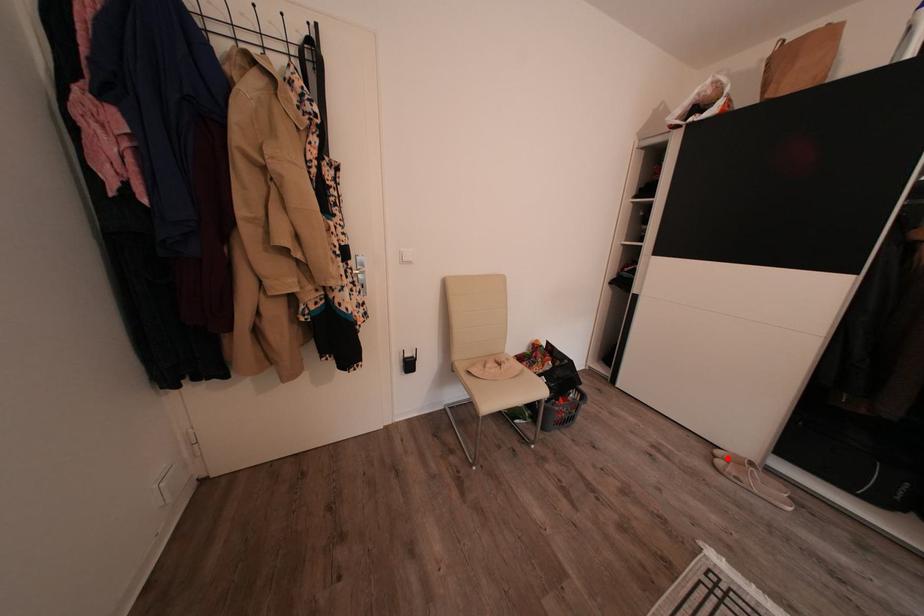
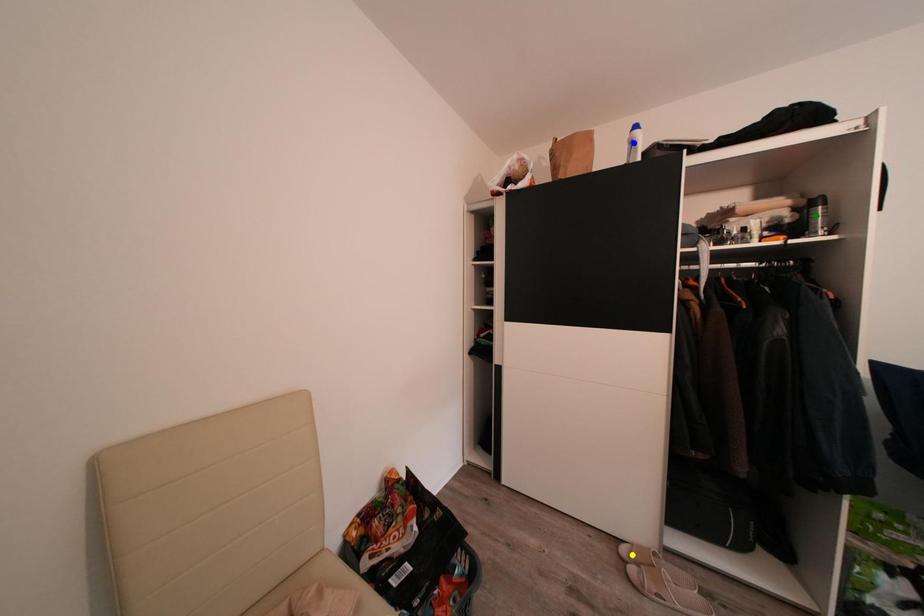
Question: I am providing you with two images of the same scene from different viewpoints. A red point is marked on the first image. You are given multiple points on the second image. Can you choose the point in image 2 that corresponds to the point in image 1?

Choices:
 (A) green point
 (B) blue point
 (C) yellow point

Answer: (C)